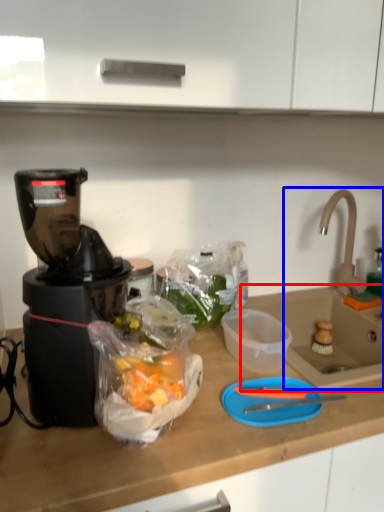
Question: Which object appears closest to the camera in this image, sink (highlighted by a red box) or sink (highlighted by a blue box)?

Choices:
 (A) sink
 (B) sink

Answer: (A)